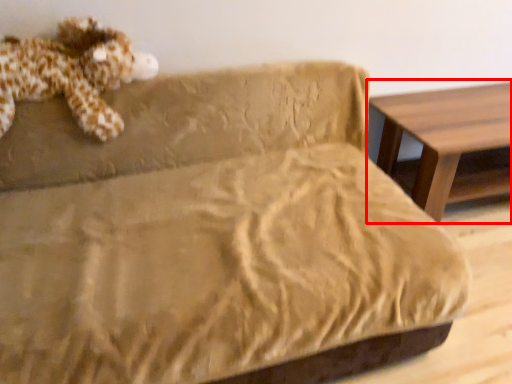
Question: Where is table (annotated by the red box) located in relation to toy in the image?

Choices:
 (A) left
 (B) right

Answer: (B)